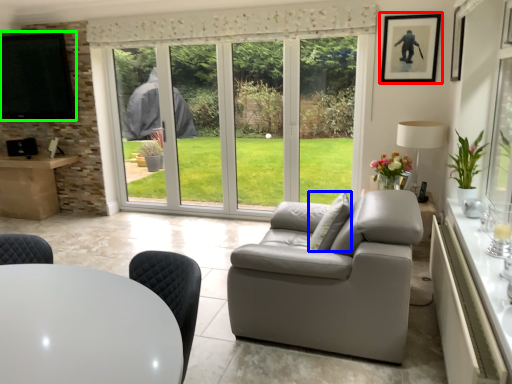
Question: Based on their relative distances, which object is nearer to picture frame (highlighted by a red box)? Choose from pillow (highlighted by a blue box) and window screen (highlighted by a green box).

Choices:
 (A) pillow
 (B) window screen

Answer: (A)